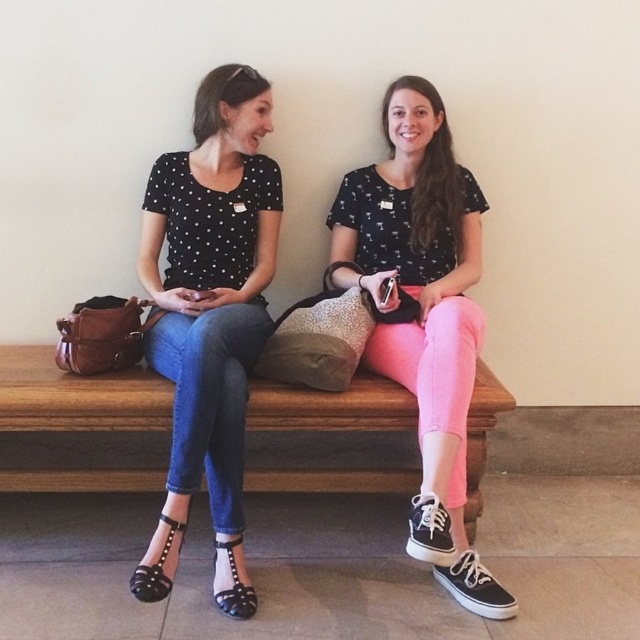
You are standing in front of the bench where two people are sitting. There is a point marked at coordinates (209, 316). What item is located exactly at that point?

The item located exactly at point (209, 316) is the matte black polka dot blouse at center.

You are standing in front of the bench where two people are sitting. You need to place a small gift exactly where the pink matte pants at center are located. Can you describe the exact coordinates where you should place it?

The pink matte pants at center are located at coordinates point (x=422, y=312), so you should place the small gift there.

You are standing in front of the bench where two people are sitting. You need to place a small plant pot between them. The first point to place it at is point (452,224) and the second point is point (29,470). Which point is closer to the back of the bench?

Point (452,224) is behind point (29,470), so the point closer to the back of the bench is point (452,224).